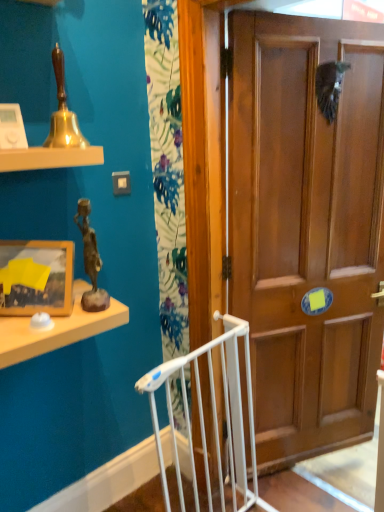
This screenshot has width=384, height=512. What do you see at coordinates (38, 277) in the screenshot?
I see `wooden framed picture at left` at bounding box center [38, 277].

The width and height of the screenshot is (384, 512). I want to click on wooden door at center, so click(307, 229).

How much distance is there between wooden door at center and wooden framed picture at left?

1.02 meters.

Between wooden door at center and wooden framed picture at left, which one appears on the right side from the viewer's perspective?

wooden door at center is more to the right.

Where is `picture frame below the wooden door at center (from the image's perspective)`? Image resolution: width=384 pixels, height=512 pixels. picture frame below the wooden door at center (from the image's perspective) is located at coordinates (38, 277).

Is wooden door at center oriented away from wooden framed picture at left?

No, wooden door at center is not facing away from wooden framed picture at left.

In terms of width, does bronze statue at upper left look wider or thinner when compared to wooden door at center?

In the image, bronze statue at upper left appears to be wider than wooden door at center.

Considering the positions of objects bronze statue at upper left and wooden door at center in the image provided, who is behind, bronze statue at upper left or wooden door at center?

wooden door at center is more distant.

Measure the distance between bronze statue at upper left and wooden door at center.

bronze statue at upper left and wooden door at center are 37.02 inches apart.

Identify the location of door that appears below the bronze statue at upper left (from a real-world perspective). This screenshot has height=512, width=384. (307, 229).

What's the angular difference between wooden door at center and bronze statue at upper left's facing directions?

The angular difference between wooden door at center and bronze statue at upper left is 21.6 degrees.

Which object is positioned more to the left, wooden door at center or bronze statue at upper left?

From the viewer's perspective, bronze statue at upper left appears more on the left side.

I want to click on picture frame above the wooden door at center (from a real-world perspective), so coord(38,277).

Is wooden framed picture at left inside the boundaries of wooden door at center, or outside?

wooden framed picture at left is not inside wooden door at center, it's outside.

Is the depth of wooden framed picture at left less than that of wooden door at center?

Yes, wooden framed picture at left is closer to the viewer.

Is wooden framed picture at left turned away from wooden door at center?

No, wooden door at center is not at the back of wooden framed picture at left.

In the image, is bronze statue at upper left positioned in front of or behind wooden framed picture at left?

bronze statue at upper left is in front of wooden framed picture at left.

From the image's perspective, is bronze statue at upper left under wooden framed picture at left?

Actually, bronze statue at upper left appears above wooden framed picture at left in the image.

From a real-world perspective, is bronze statue at upper left positioned above or below wooden framed picture at left?

From a real-world perspective, bronze statue at upper left is physically above wooden framed picture at left.

Is wooden framed picture at left located within bronze statue at upper left?

No, bronze statue at upper left does not contain wooden framed picture at left.

From the image's perspective, is wooden framed picture at left on top of bronze statue at upper left?

No, from the image's perspective, wooden framed picture at left is not on top of bronze statue at upper left.

Is point (49, 304) closer to camera compared to point (93, 311)?

Yes, point (49, 304) is closer to viewer.

Does wooden framed picture at left contain bronze statue at upper left?

No.

From a real-world perspective, does wooden framed picture at left stand above bronze statue at upper left?

No, from a real-world perspective, wooden framed picture at left is not above bronze statue at upper left.

Image resolution: width=384 pixels, height=512 pixels. Identify the location of picture frame above the wooden door at center (from a real-world perspective). (38, 277).

Identify the location of door on the right of the bronze statue at upper left. This screenshot has height=512, width=384. tap(307, 229).

Estimate the real-world distances between objects in this image. Which object is closer to wooden door at center, wooden framed picture at left or bronze statue at upper left?

Among the two, bronze statue at upper left is located nearer to wooden door at center.

Looking at the image, which one is located further to wooden framed picture at left, bronze statue at upper left or wooden door at center?

wooden door at center is further to wooden framed picture at left.

Based on their spatial positions, is bronze statue at upper left or wooden framed picture at left closer to wooden door at center?

bronze statue at upper left is positioned closer to the anchor wooden door at center.

Considering their positions, is wooden framed picture at left positioned closer to bronze statue at upper left than wooden door at center?

wooden framed picture at left is closer to bronze statue at upper left.

Estimate the real-world distances between objects in this image. Which object is closer to bronze statue at upper left, wooden door at center or wooden framed picture at left?

wooden framed picture at left.

Considering their positions, is wooden door at center positioned closer to wooden framed picture at left than bronze statue at upper left?

bronze statue at upper left is positioned closer to the anchor wooden framed picture at left.

This screenshot has width=384, height=512. In order to click on toy between wooden framed picture at left and wooden door at center from left to right in this screenshot , I will do `click(90, 261)`.